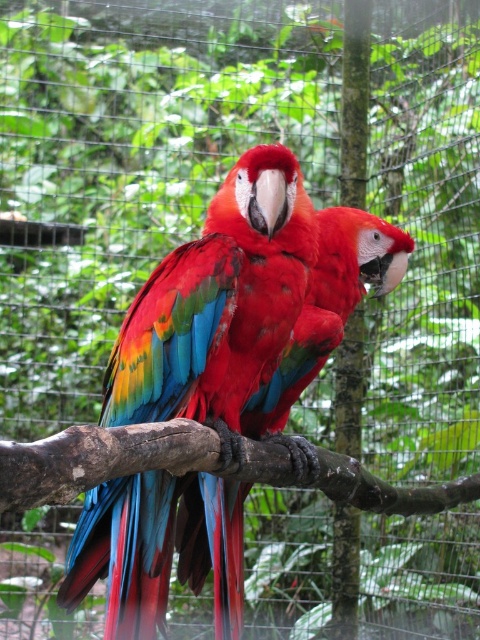
Question: Which point is closer to the camera?

Choices:
 (A) (294, 454)
 (B) (394, 513)

Answer: (A)

Question: Which of the following is the farthest from the observer?

Choices:
 (A) (95, 454)
 (B) (132, 600)

Answer: (B)

Question: In this image, where is glossy feathers parrot at center located relative to brown rough tree branch at center?

Choices:
 (A) below
 (B) above

Answer: (B)

Question: Is glossy feathers parrot at center in front of brown rough tree branch at center?

Choices:
 (A) yes
 (B) no

Answer: (B)

Question: Does glossy feathers parrot at center have a smaller size compared to brown rough tree branch at center?

Choices:
 (A) no
 (B) yes

Answer: (B)